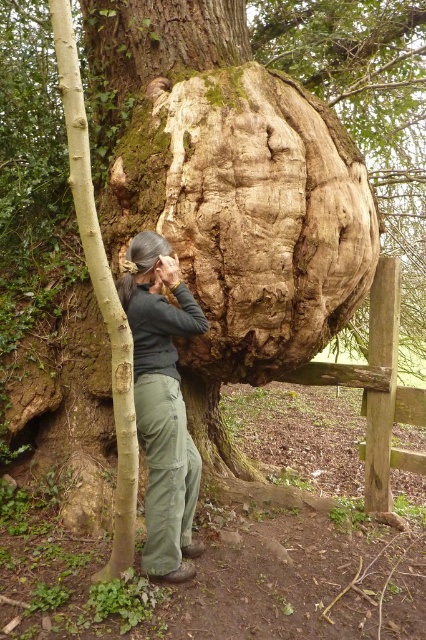
Does dark green pants at center appear under smooth light brown bark at left?

Yes.

Between point (161, 276) and point (60, 68), which one is positioned behind?

Positioned behind is point (161, 276).

The image size is (426, 640). In order to click on dark green pants at center in this screenshot , I will do `click(161, 403)`.